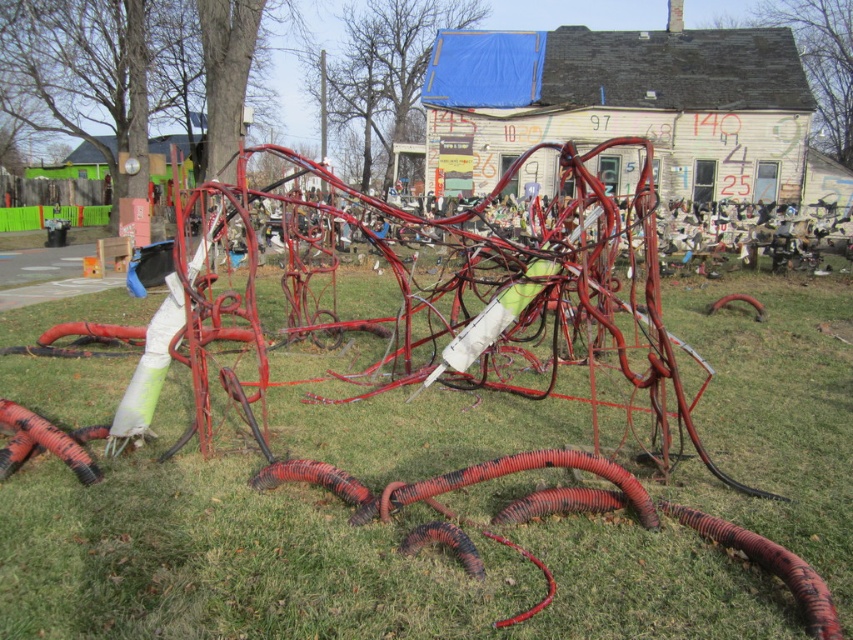
You are a gardener who wants to plant a new flower bed. You need to choose between the green grass at center and the rubber hose at lower left. Which area is more suitable for planting?

The green grass at center is larger in size than the rubber hose at lower left, making it more suitable for planting since it provides a sufficient area for the flower bed.